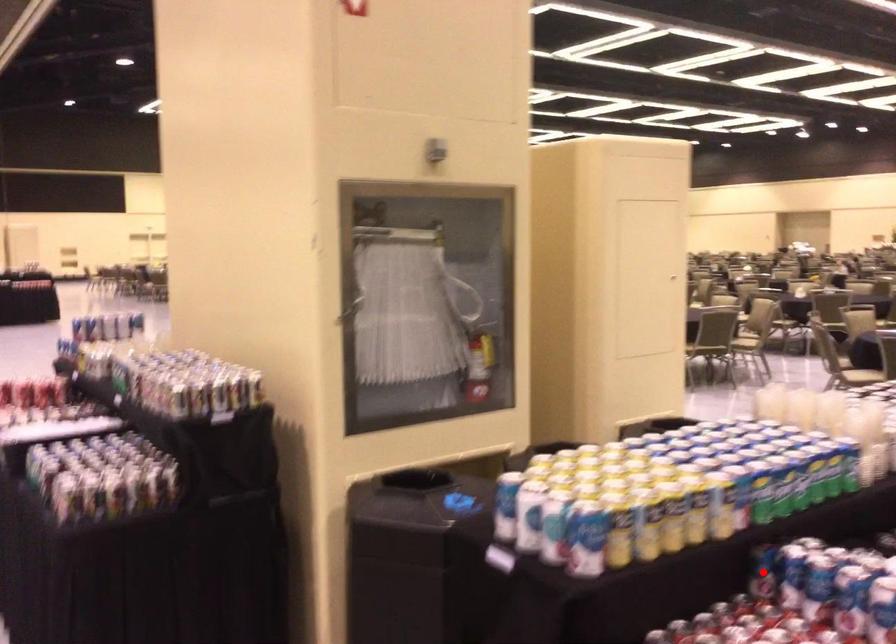
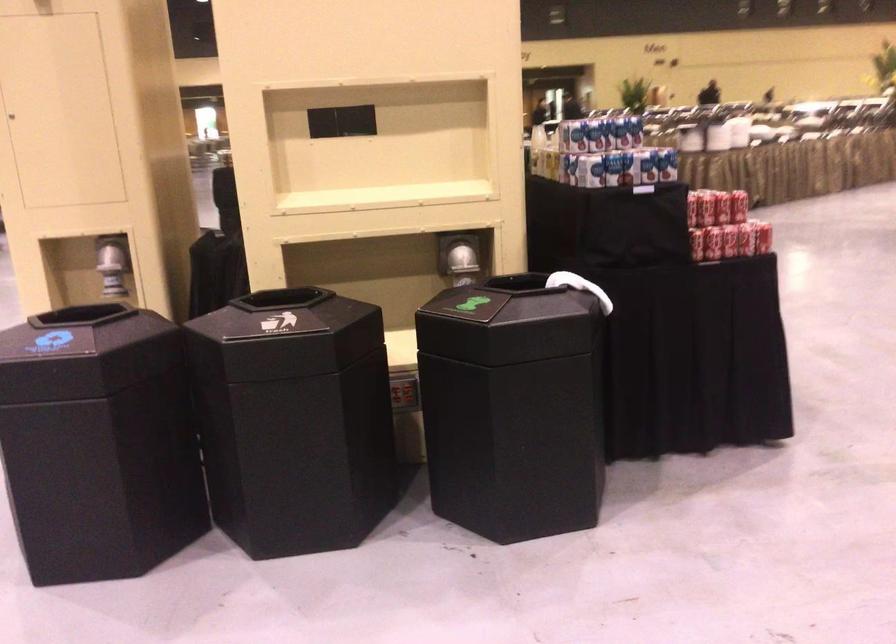
Question: I am providing you with two images of the same scene from different viewpoints. A red point is marked on the first image. Is the red point's position out of view in image 2?

Choices:
 (A) Yes
 (B) No

Answer: (A)